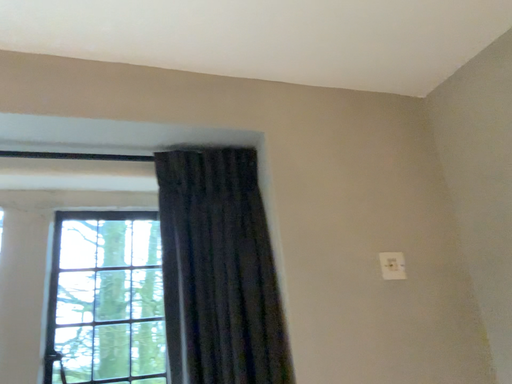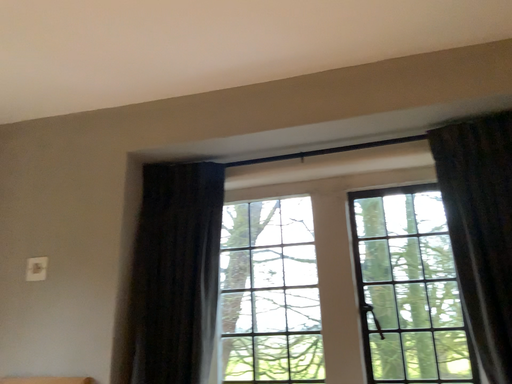
Question: How did the camera likely rotate when shooting the video?

Choices:
 (A) rotated left
 (B) rotated right

Answer: (A)